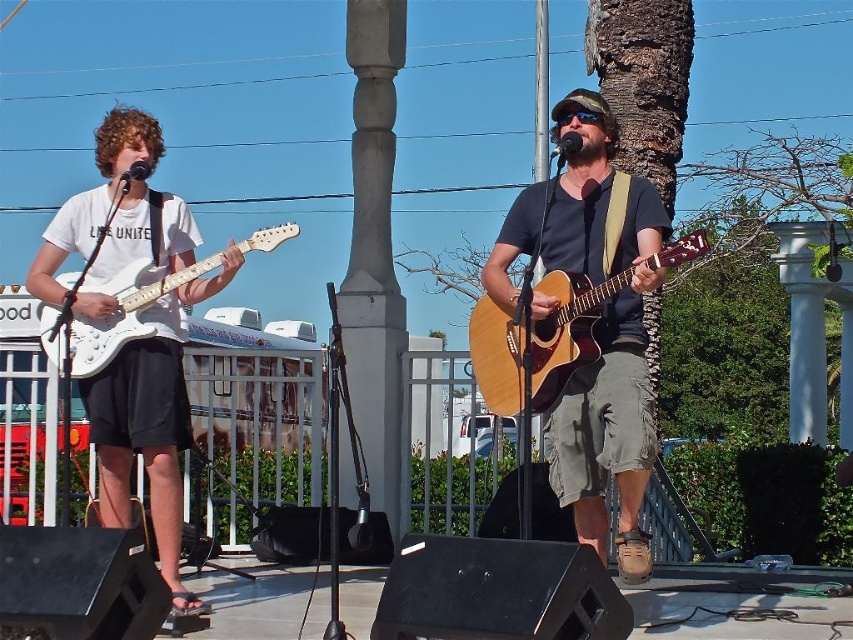
Does point (573, 442) lie in front of point (109, 161)?

Yes, point (573, 442) is in front of point (109, 161).

Can you confirm if wooden acoustic guitar at center is thinner than white matte guitar at left?

Yes, wooden acoustic guitar at center is thinner than white matte guitar at left.

Which is in front, point (631, 342) or point (180, 387)?

Point (631, 342) is in front.

Locate an element on the screen. wooden acoustic guitar at center is located at coordinates (604, 333).

Can you confirm if wooden acoustic guitar at center is taller than white glossy electric guitar at left?

Indeed, wooden acoustic guitar at center has a greater height compared to white glossy electric guitar at left.

Does wooden acoustic guitar at center appear on the right side of white glossy electric guitar at left?

Correct, you'll find wooden acoustic guitar at center to the right of white glossy electric guitar at left.

Is point (596, 186) positioned behind point (132, 266)?

No, (596, 186) is closer to viewer.

In order to click on wooden acoustic guitar at center in this screenshot , I will do `click(604, 333)`.

Does white matte guitar at left have a lesser width compared to natural wood acoustic guitar at center?

No, white matte guitar at left is not thinner than natural wood acoustic guitar at center.

What do you see at coordinates (149, 424) in the screenshot? The width and height of the screenshot is (853, 640). I see `white matte guitar at left` at bounding box center [149, 424].

Which is behind, point (119, 212) or point (525, 330)?

Point (119, 212)

The height and width of the screenshot is (640, 853). Identify the location of white matte guitar at left. (149, 424).